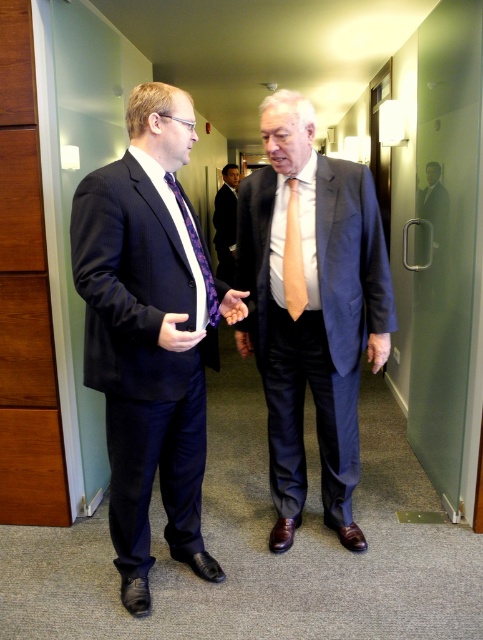
Question: Which point is farther from the camera taking this photo?

Choices:
 (A) (340, 406)
 (B) (286, 218)
 (C) (217, 221)
 (D) (194, 240)

Answer: (C)

Question: Which of these objects is positioned closest to the matte black suit at left?

Choices:
 (A) satin blue suit at center
 (B) matte black hand at center
 (C) matte black suit at center

Answer: (B)

Question: Where is satin blue suit at center located in relation to smooth orange hand at center in the image?

Choices:
 (A) left
 (B) right

Answer: (B)

Question: Which object appears closest to the camera in this image?

Choices:
 (A) orange silk tie at center
 (B) satin blue suit at center

Answer: (B)

Question: Does orange silk tie at center come in front of matte black suit at center?

Choices:
 (A) no
 (B) yes

Answer: (B)

Question: Is orange silk tie at center to the left of matte black hand at center from the viewer's perspective?

Choices:
 (A) no
 (B) yes

Answer: (A)